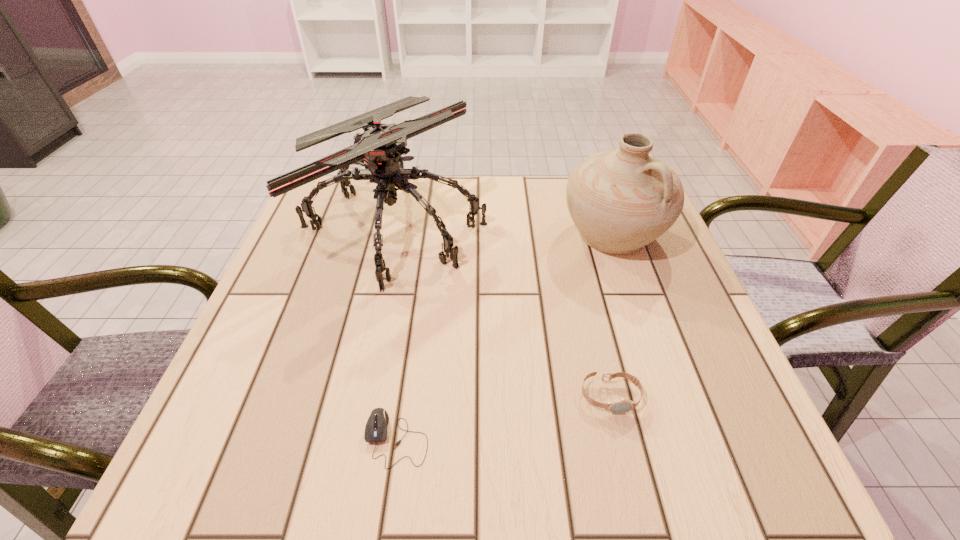
Identify the location of free spot between the computer mouse and the pottery. (505, 336).

Locate an element on the screen. The width and height of the screenshot is (960, 540). object that is the third closest to the second shortest object is located at coordinates (620, 200).

Identify which object is located as the nearest to the shortest object. Please provide its 2D coordinates. Your answer should be formatted as a tuple, i.e. [(x, y)], where the tuple contains the x and y coordinates of a point satisfying the conditions above.

[(622, 405)]

Find the location of `free spot that satisfies the following two spatial constraints: 1. on the back side of the pottery; 2. on the left side of the computer mouse`. free spot that satisfies the following two spatial constraints: 1. on the back side of the pottery; 2. on the left side of the computer mouse is located at coordinates (425, 234).